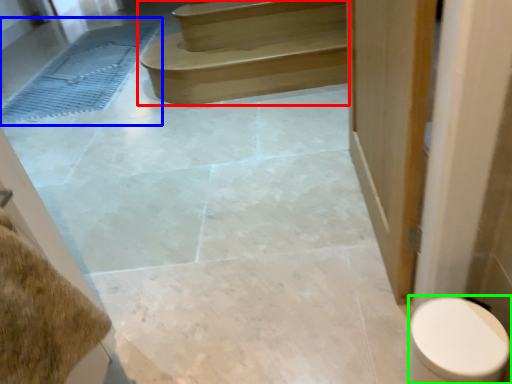
Question: Which object is positioned farthest from stairs (highlighted by a red box)? Select from bath mat (highlighted by a blue box) and toilet (highlighted by a green box).

Choices:
 (A) bath mat
 (B) toilet

Answer: (B)